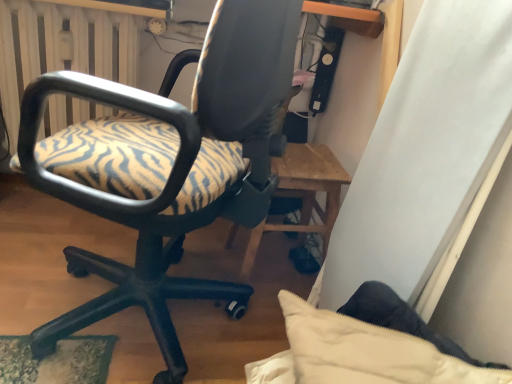
Image resolution: width=512 pixels, height=384 pixels. Identify the location of vacant area on top of white radiator at upper left (from a real-world perspective). (77, 9).